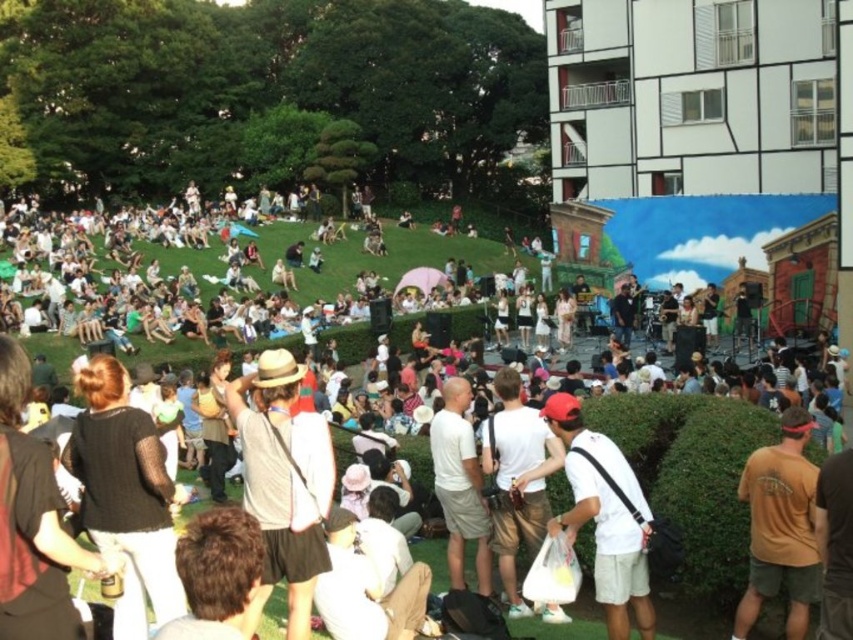
Which of these two, white matte baseball cap at center or brown cotton t-shirt at lower right, stands taller?

brown cotton t-shirt at lower right is taller.

Is white matte baseball cap at center behind brown cotton t-shirt at lower right?

Yes, it is behind brown cotton t-shirt at lower right.

Locate an element on the screen. white matte baseball cap at center is located at coordinates (605, 516).

Consider the image. Who is taller, white cotton shirt at center or white matte baseball cap at center?

white cotton shirt at center

Describe the element at coordinates (120, 291) in the screenshot. I see `white cotton shirt at center` at that location.

At what (x,y) coordinates should I click in order to perform the action: click on white cotton shirt at center. Please return your answer as a coordinate pair (x, y). Looking at the image, I should click on (120, 291).

Is white cotton shirt at center shorter than brown cotton t-shirt at lower right?

In fact, white cotton shirt at center may be taller than brown cotton t-shirt at lower right.

Looking at this image, is white cotton shirt at center above brown cotton t-shirt at lower right?

Yes, white cotton shirt at center is above brown cotton t-shirt at lower right.

Does point (273, 300) come closer to viewer compared to point (792, 477)?

No, it is not.

Locate an element on the screen. white cotton shirt at center is located at coordinates (120, 291).